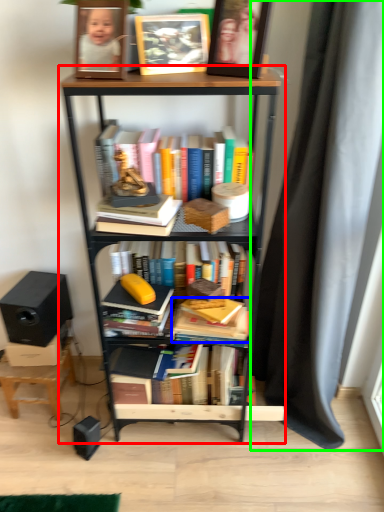
Question: Considering the real-world distances, which object is closest to bookcase (highlighted by a red box)? book (highlighted by a blue box) or curtain (highlighted by a green box).

Choices:
 (A) book
 (B) curtain

Answer: (B)